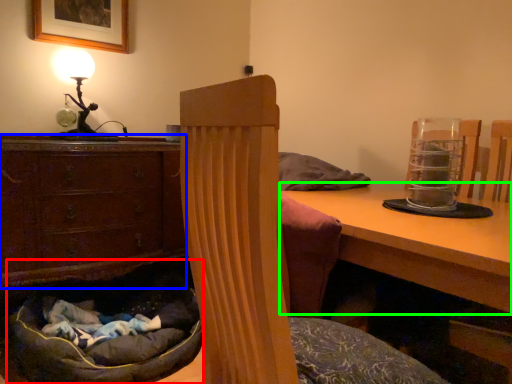
Question: Considering the real-world distances, which object is farthest from bean bag chair (highlighted by a red box)? chest of drawers (highlighted by a blue box) or table (highlighted by a green box)?

Choices:
 (A) chest of drawers
 (B) table

Answer: (B)